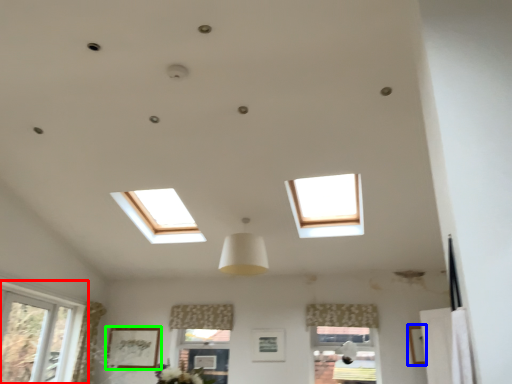
Question: Which is nearer to the window (highlighted by a red box)? picture frame (highlighted by a blue box) or picture frame (highlighted by a green box).

Choices:
 (A) picture frame
 (B) picture frame

Answer: (B)